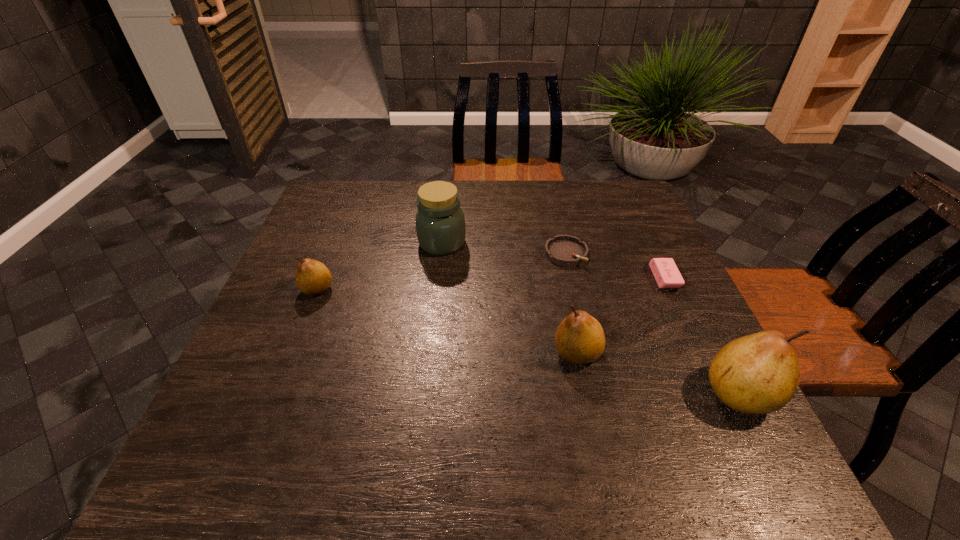
The image size is (960, 540). I want to click on the shortest pear, so click(x=313, y=278).

Identify the location of the leftmost object. The width and height of the screenshot is (960, 540). (313, 278).

The width and height of the screenshot is (960, 540). What are the coordinates of `the fourth shortest object` in the screenshot? It's located at (579, 339).

Find the location of a particular element. the second shortest pear is located at coordinates (579, 339).

Image resolution: width=960 pixels, height=540 pixels. In order to click on the rightmost pear in this screenshot , I will do `click(755, 374)`.

This screenshot has width=960, height=540. I want to click on eraser, so click(665, 271).

Where is `ashtray`? Image resolution: width=960 pixels, height=540 pixels. ashtray is located at coordinates (565, 250).

Where is `the second object from left to right`? the second object from left to right is located at coordinates (440, 223).

This screenshot has width=960, height=540. I want to click on vacant position located on the back of the shortest pear, so click(351, 204).

Find the location of `vacant space located 0.340m on the left of the fourth shortest object`. vacant space located 0.340m on the left of the fourth shortest object is located at coordinates (395, 353).